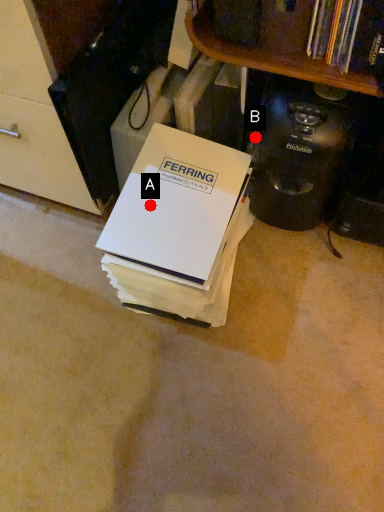
Question: Two points are circled on the image, labeled by A and B beside each circle. Which point is closer to the camera?

Choices:
 (A) A is closer
 (B) B is closer

Answer: (A)